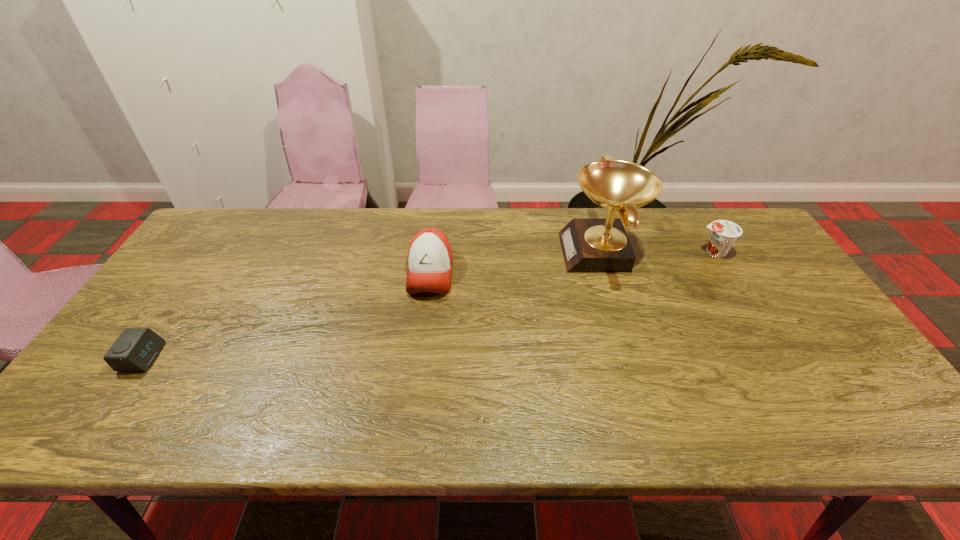
At what (x,y) coordinates should I click in order to perform the action: click on vacant region located 0.240m on the front-facing side of the award. Please return your answer as a coordinate pair (x, y). This screenshot has width=960, height=540. Looking at the image, I should click on (486, 253).

Locate an element on the screen. This screenshot has width=960, height=540. vacant space located on the front-facing side of the third shortest object is located at coordinates (414, 407).

Locate an element on the screen. blank space located on the front of the third tallest object is located at coordinates (765, 338).

Locate an element on the screen. The image size is (960, 540). free point located on the front-facing side of the nearest object is located at coordinates (295, 357).

Locate an element on the screen. This screenshot has height=540, width=960. award present at the far edge is located at coordinates (590, 245).

In order to click on baseball cap situated at the far edge in this screenshot , I will do `click(430, 257)`.

Locate an element on the screen. This screenshot has height=540, width=960. yogurt located at the far edge is located at coordinates (724, 233).

This screenshot has width=960, height=540. Identify the location of object positioned at the left edge. (136, 349).

Locate an element on the screen. object that is at the right edge is located at coordinates (724, 233).

Image resolution: width=960 pixels, height=540 pixels. What are the coordinates of `object that is at the far right corner` in the screenshot? It's located at (724, 233).